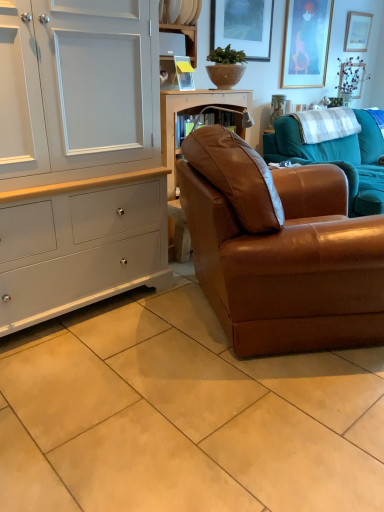
Question: From a real-world perspective, is beige ceramic tile at lower center positioned under white plastic shelf at upper center, the 1th shelf ordered from the bottom, based on gravity?

Choices:
 (A) yes
 (B) no

Answer: (A)

Question: Is the position of beige ceramic tile at lower center more distant than that of white plastic shelf at upper center, marked as the 2th shelf in a top-to-bottom arrangement?

Choices:
 (A) yes
 (B) no

Answer: (B)

Question: Is beige ceramic tile at lower center directly adjacent to white plastic shelf at upper center, marked as the 2th shelf in a top-to-bottom arrangement?

Choices:
 (A) no
 (B) yes

Answer: (A)

Question: Is beige ceramic tile at lower center facing towards white plastic shelf at upper center, marked as the 2th shelf in a top-to-bottom arrangement?

Choices:
 (A) yes
 (B) no

Answer: (B)

Question: Is beige ceramic tile at lower center to the left of white plastic shelf at upper center, marked as the 2th shelf in a top-to-bottom arrangement, from the viewer's perspective?

Choices:
 (A) no
 (B) yes

Answer: (A)

Question: Considering their positions, is white wood shelf at upper center, the 1th shelf viewed from the top, located in front of or behind beige ceramic tile at lower center?

Choices:
 (A) front
 (B) behind

Answer: (B)

Question: Considering the positions of point (168, 4) and point (372, 368), is point (168, 4) closer or farther from the camera than point (372, 368)?

Choices:
 (A) farther
 (B) closer

Answer: (A)

Question: From the image's perspective, is white wood shelf at upper center, the 1th shelf viewed from the top, located above or below beige ceramic tile at lower center?

Choices:
 (A) below
 (B) above

Answer: (B)

Question: Do you think white wood shelf at upper center, which appears as the second shelf when ordered from the bottom, is within beige ceramic tile at lower center, or outside of it?

Choices:
 (A) inside
 (B) outside

Answer: (B)

Question: From a real-world perspective, relative to brown leather couch at center, the first studio couch when ordered from back to front, is white painted wood cabinet at left vertically above or below?

Choices:
 (A) above
 (B) below

Answer: (A)

Question: Is white painted wood cabinet at left to the left or to the right of brown leather couch at center, the first studio couch when ordered from back to front, in the image?

Choices:
 (A) left
 (B) right

Answer: (A)

Question: From the image's perspective, is white painted wood cabinet at left above or below brown leather couch at center, the first studio couch when ordered from back to front?

Choices:
 (A) below
 (B) above

Answer: (A)

Question: In terms of height, does white painted wood cabinet at left look taller or shorter compared to brown leather couch at center, placed as the 2th studio couch when sorted from front to back?

Choices:
 (A) tall
 (B) short

Answer: (A)

Question: Is white checkered blanket at upper right situated inside brown leather couch at center, the first studio couch when ordered from back to front, or outside?

Choices:
 (A) inside
 (B) outside

Answer: (A)

Question: Is point (340, 128) closer or farther from the camera than point (350, 203)?

Choices:
 (A) closer
 (B) farther

Answer: (B)